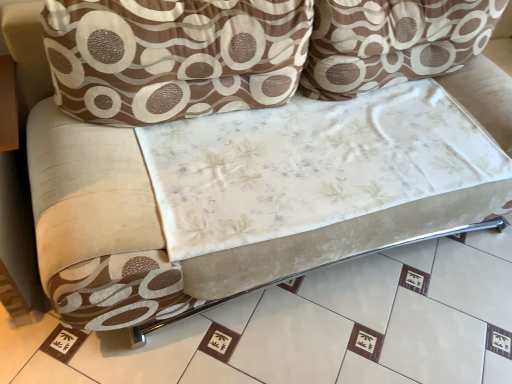
Question: Can you confirm if brown textured pillow at upper center, the first throw pillow in the left-to-right sequence, is smaller than brown textured pillow at upper center, the 2th throw pillow viewed from the left?

Choices:
 (A) yes
 (B) no

Answer: (A)

Question: Does brown textured pillow at upper center, placed as the second throw pillow when sorted from right to left, have a lesser width compared to brown textured pillow at upper center, the 2th throw pillow viewed from the left?

Choices:
 (A) yes
 (B) no

Answer: (A)

Question: Could you tell me if brown textured pillow at upper center, the first throw pillow in the left-to-right sequence, is turned towards brown textured pillow at upper center, the 2th throw pillow viewed from the left?

Choices:
 (A) yes
 (B) no

Answer: (B)

Question: Is brown textured pillow at upper center, the first throw pillow in the left-to-right sequence, to the right of brown textured pillow at upper center, which is the 1th throw pillow from right to left, from the viewer's perspective?

Choices:
 (A) yes
 (B) no

Answer: (B)

Question: Is brown textured pillow at upper center, placed as the second throw pillow when sorted from right to left, completely or partially outside of brown textured pillow at upper center, the 2th throw pillow viewed from the left?

Choices:
 (A) no
 (B) yes

Answer: (B)

Question: Visually, is brown textured pillow at upper center, the 2th throw pillow viewed from the left, positioned to the left or to the right of white fabric at center?

Choices:
 (A) left
 (B) right

Answer: (B)

Question: From a real-world perspective, is brown textured pillow at upper center, which is the 1th throw pillow from right to left, positioned above or below white fabric at center?

Choices:
 (A) below
 (B) above

Answer: (B)

Question: In the image, is brown textured pillow at upper center, the 2th throw pillow viewed from the left, positioned in front of or behind white fabric at center?

Choices:
 (A) behind
 (B) front

Answer: (A)

Question: Considering the positions of point (452, 33) and point (365, 372), is point (452, 33) closer or farther from the camera than point (365, 372)?

Choices:
 (A) farther
 (B) closer

Answer: (A)

Question: Considering the positions of point (181, 329) and point (468, 21), is point (181, 329) closer or farther from the camera than point (468, 21)?

Choices:
 (A) farther
 (B) closer

Answer: (B)

Question: Is white fabric at center taller or shorter than brown textured pillow at upper center, the 2th throw pillow viewed from the left?

Choices:
 (A) tall
 (B) short

Answer: (B)

Question: In the image, is white fabric at center on the left side or the right side of brown textured pillow at upper center, which is the 1th throw pillow from right to left?

Choices:
 (A) left
 (B) right

Answer: (A)

Question: Is white fabric at center in front of or behind brown textured pillow at upper center, which is the 1th throw pillow from right to left, in the image?

Choices:
 (A) behind
 (B) front

Answer: (B)

Question: In the image, is white fabric at center positioned in front of or behind brown textured pillow at upper center, the first throw pillow in the left-to-right sequence?

Choices:
 (A) front
 (B) behind

Answer: (A)

Question: Considering the positions of point (216, 364) and point (307, 33), is point (216, 364) closer or farther from the camera than point (307, 33)?

Choices:
 (A) farther
 (B) closer

Answer: (B)